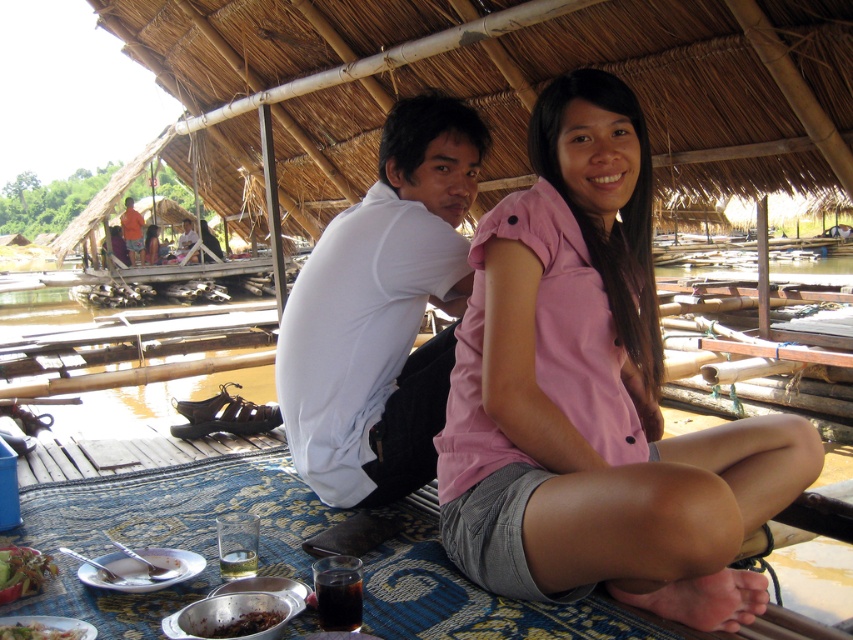
Question: Where is green leafy vegetables at lower left located in relation to green leafy salad at lower left in the image?

Choices:
 (A) left
 (B) right

Answer: (A)

Question: Which point is farther from the camera taking this photo?

Choices:
 (A) (38, 580)
 (B) (4, 637)

Answer: (A)

Question: Does green leafy vegetables at lower left appear on the right side of green leafy salad at lower left?

Choices:
 (A) no
 (B) yes

Answer: (A)

Question: Which object appears closest to the camera in this image?

Choices:
 (A) pink fabric shirt at center
 (B) dark brown glossy food at lower center
 (C) white matte shirt at center
 (D) green leafy salad at lower left

Answer: (A)

Question: Does pink fabric shirt at center have a greater width compared to dark brown glossy food at lower center?

Choices:
 (A) no
 (B) yes

Answer: (B)

Question: Estimate the real-world distances between objects in this image. Which object is farther from the pink fabric shirt at center?

Choices:
 (A) green leafy salad at lower left
 (B) white matte shirt at center
 (C) green leafy vegetables at lower left
 (D) dark brown glossy food at lower center

Answer: (C)